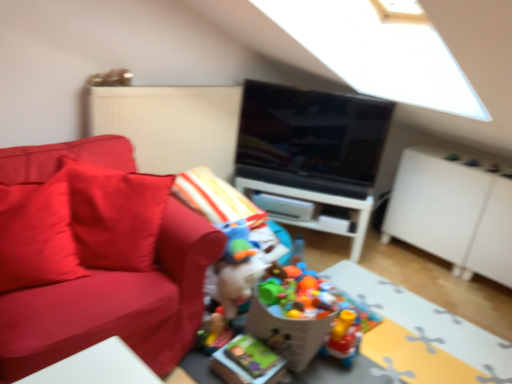
At what (x,y) coordinates should I click in order to perform the action: click on empty space that is to the right of multicolored plastic toys at center, which is the first toy in front-to-back order. Please return your answer as a coordinate pair (x, y). This screenshot has width=512, height=384. Looking at the image, I should click on (372, 362).